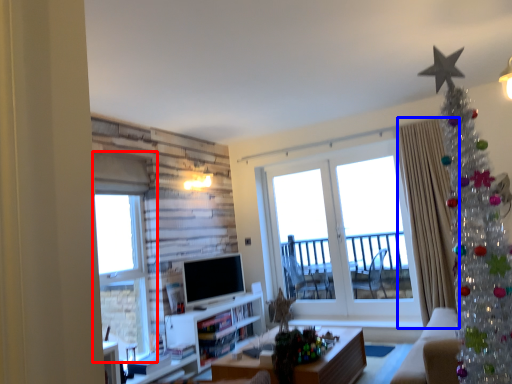
Question: Which of the following is the closest to the observer, window (highlighted by a red box) or curtain (highlighted by a blue box)?

Choices:
 (A) window
 (B) curtain

Answer: (A)